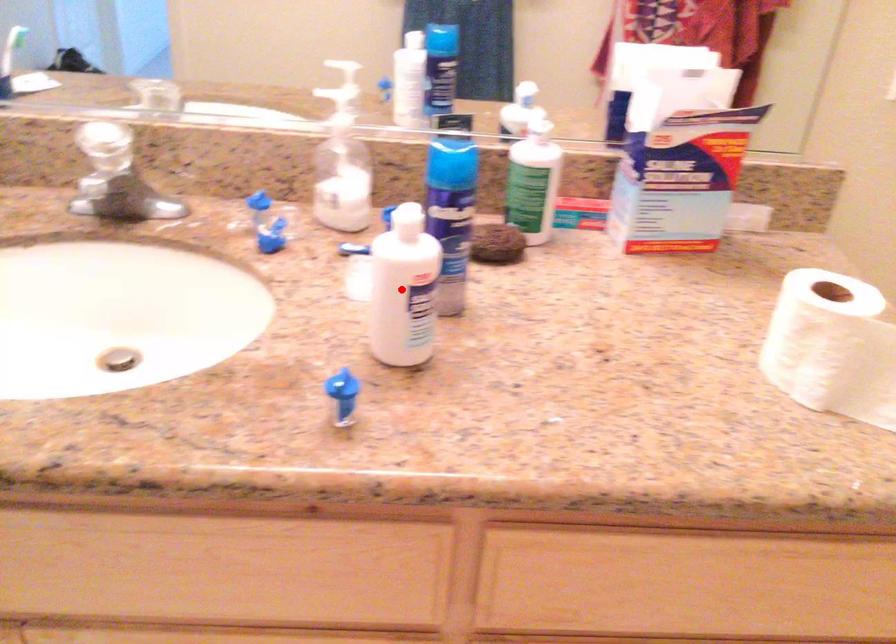
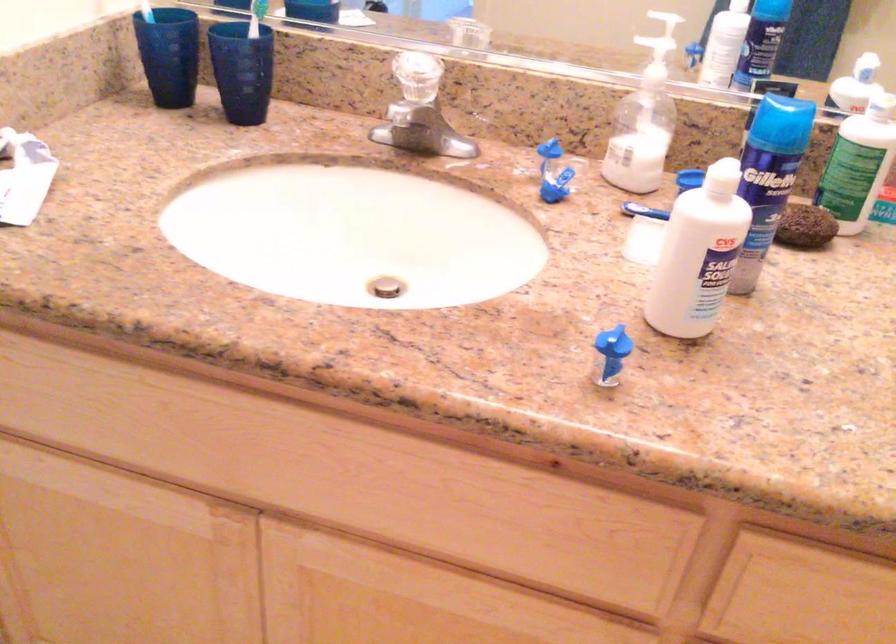
Locate, in the second image, the point that corresponds to the highlighted location in the first image.

(698, 254)